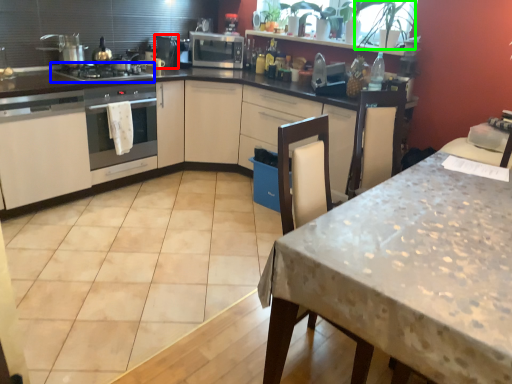
Question: Based on their relative distances, which object is farther from appliance (highlighted by a red box)? Choose from gas stove (highlighted by a blue box) and plant (highlighted by a green box).

Choices:
 (A) gas stove
 (B) plant

Answer: (B)